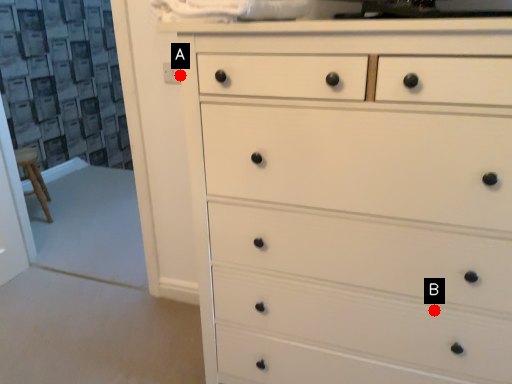
Question: Two points are circled on the image, labeled by A and B beside each circle. Which point is farther from the camera taking this photo?

Choices:
 (A) A is further
 (B) B is further

Answer: (A)